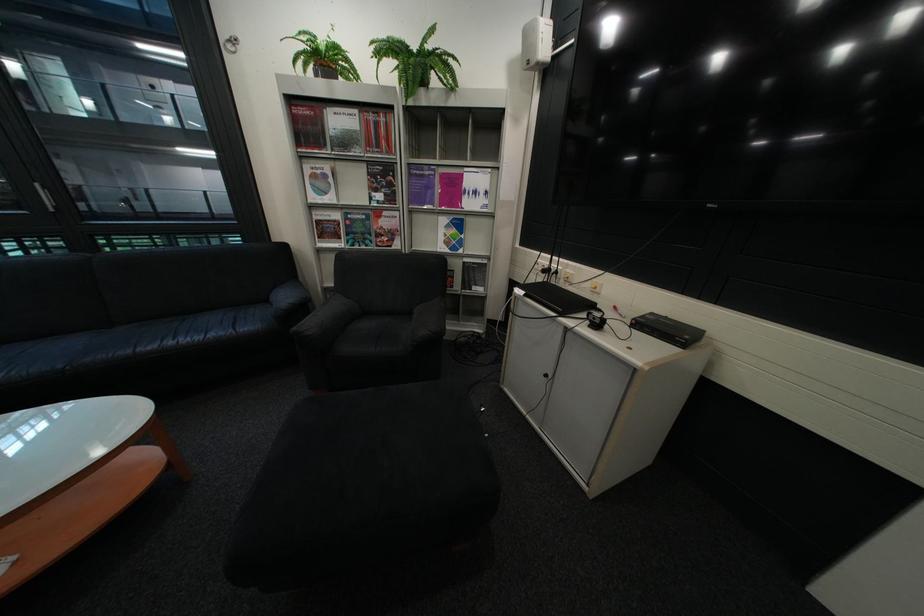
Where would you lift the black electronic device? Please return your answer as a coordinate pair (x, y).

(666, 330)